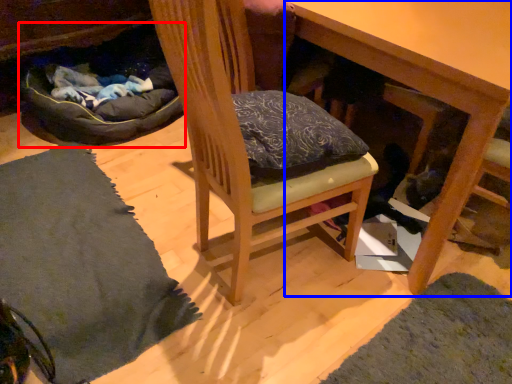
Question: Among these objects, which one is nearest to the camera, bean bag chair (highlighted by a red box) or table (highlighted by a blue box)?

Choices:
 (A) bean bag chair
 (B) table

Answer: (B)